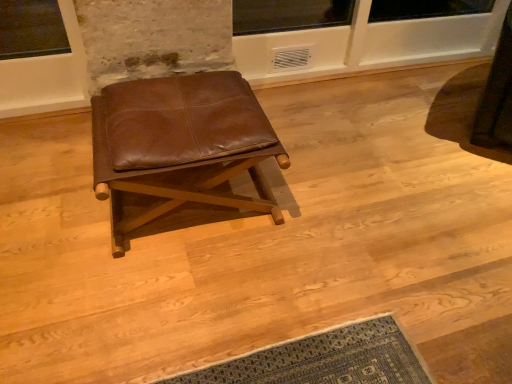
Where is `vacant region to the left of brown leather stool at center`? Image resolution: width=512 pixels, height=384 pixels. vacant region to the left of brown leather stool at center is located at coordinates (54, 191).